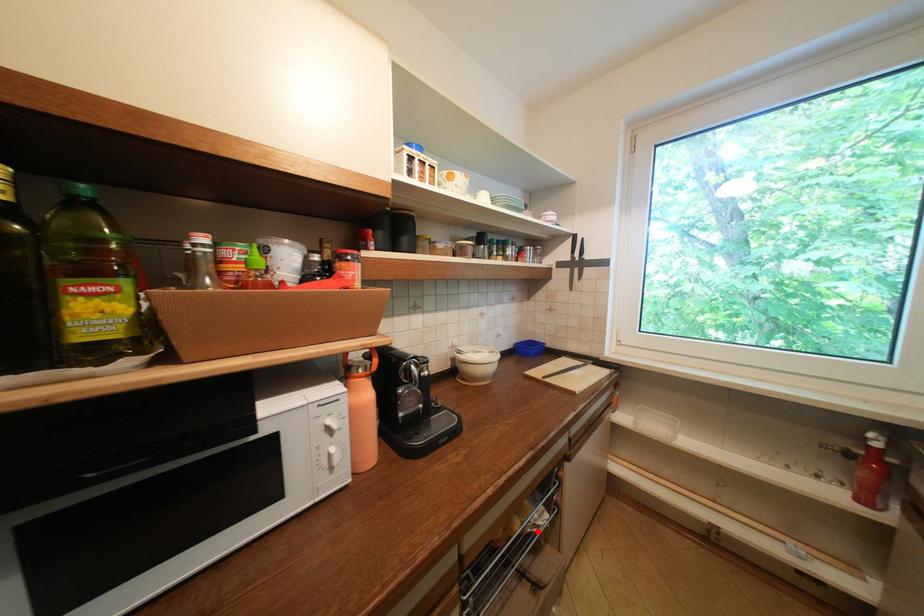
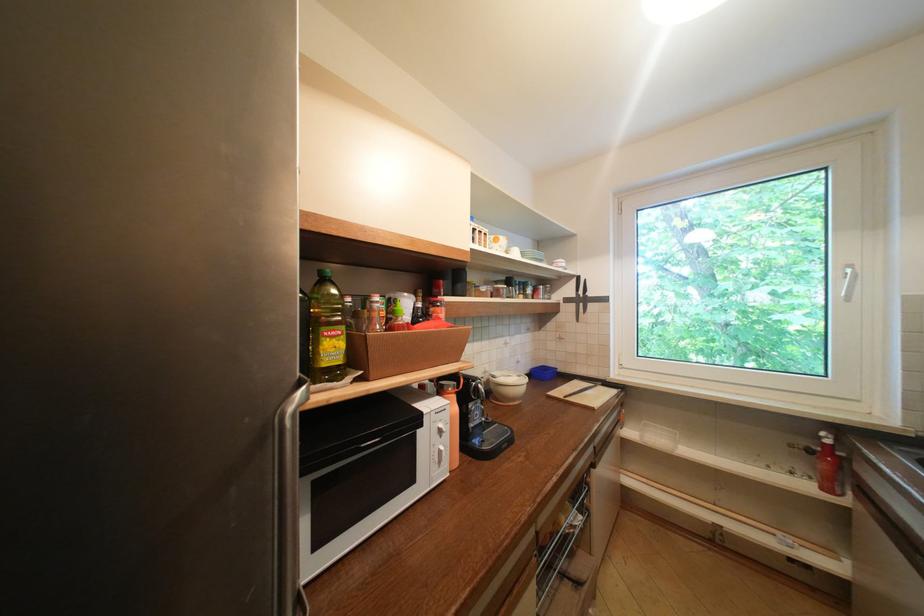
Find the pixel in the second image that matches the highlighted location in the first image.

(576, 532)